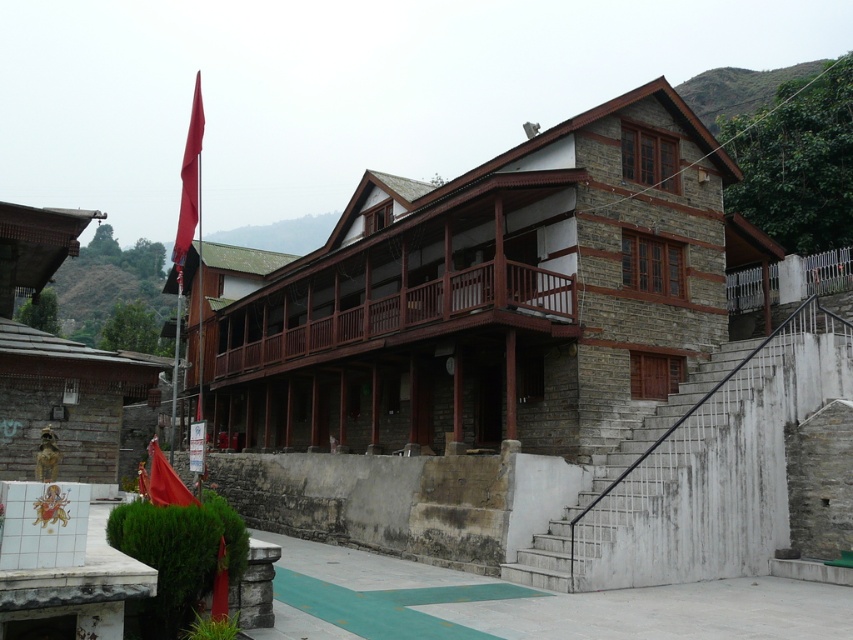
You are a visitor approaching the building and notice two red flags. The first is the red fabric flag at upper left and the second is the shiny red flag at lower left. Which flag is bigger in size?

The red fabric flag at upper left is larger in size compared to the shiny red flag at lower left.

You are a visitor approaching the building and need to reach the entrance. You see the white concrete stairs at center and the shiny red flag at lower left. Which object is closer to the ground level?

The white concrete stairs at center has a lesser height compared to the shiny red flag at lower left, so the white concrete stairs at center is closer to the ground level.